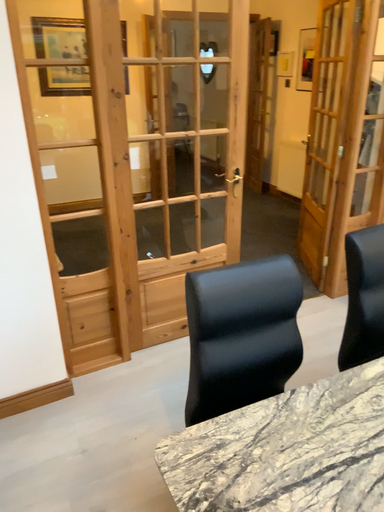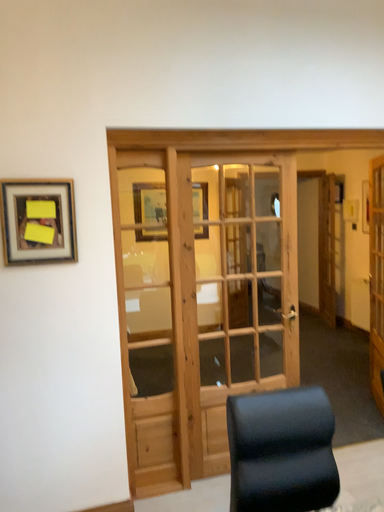
Question: Which way did the camera rotate in the video?

Choices:
 (A) rotated upward
 (B) rotated downward

Answer: (A)